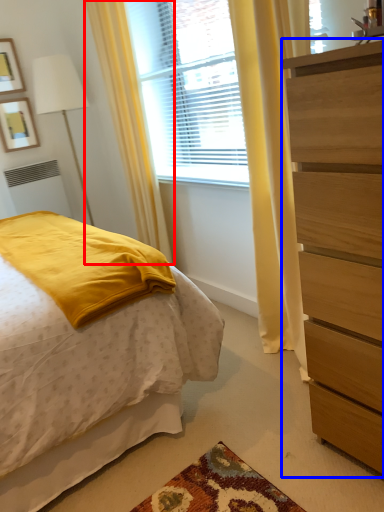
Question: Among these objects, which one is farthest to the camera, curtain (highlighted by a red box) or chest of drawers (highlighted by a blue box)?

Choices:
 (A) curtain
 (B) chest of drawers

Answer: (A)